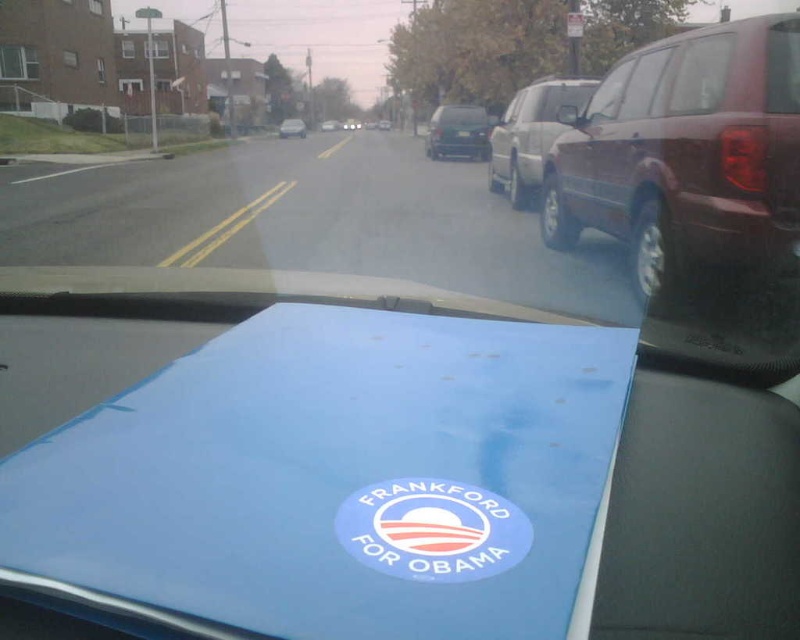
Question: Which point is farther from the camera taking this photo?

Choices:
 (A) (718, 166)
 (B) (478, 109)
 (C) (385, 529)
 (D) (644, 67)

Answer: (B)

Question: Which object appears closest to the camera in this image?

Choices:
 (A) dark brown matte suv at right
 (B) black glossy sedan at center

Answer: (A)

Question: Is transparent glass windshield at right behind black glossy sedan at center?

Choices:
 (A) no
 (B) yes

Answer: (A)

Question: Which object is positioned farthest from the black glossy sedan at center?

Choices:
 (A) dark brown matte suv at right
 (B) metallic silver sedan at center
 (C) blue matte sticker at center
 (D) satin silver suv at right

Answer: (B)

Question: Is blue matte sticker at center bigger than black glossy sedan at center?

Choices:
 (A) yes
 (B) no

Answer: (B)

Question: Is transparent glass windshield at right bigger than metallic silver sedan at center?

Choices:
 (A) no
 (B) yes

Answer: (A)